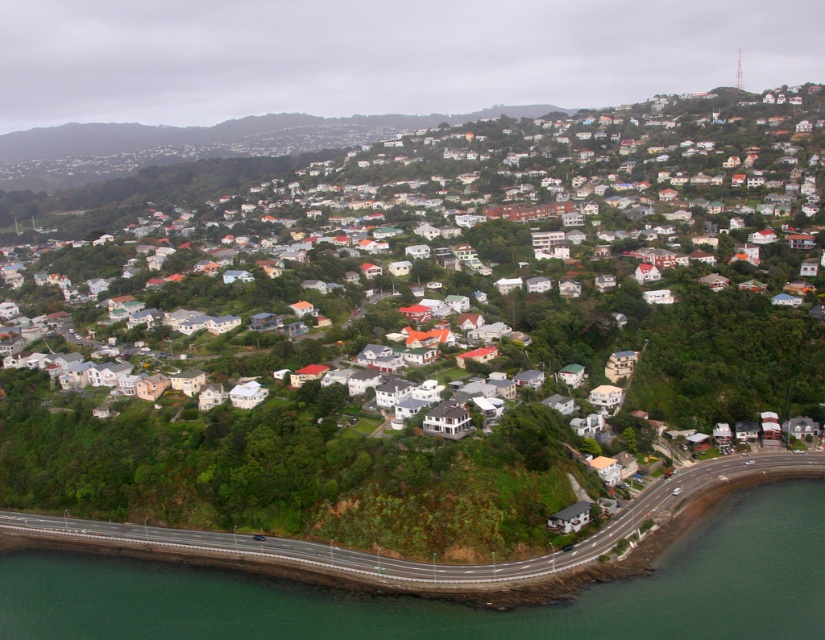
You are a drone operator tasked with capturing aerial footage of the residential area. Your camera has a zoom lens that can focus on objects up to 100 meters away. Given the scene, which object between the white matte houses at center and the green water at lower left would appear larger in your footage, and why?

The white matte houses at center would appear larger in the footage because they are physically larger in size compared to the green water at lower left, as stated in the description.

You are a drone operator tasked with capturing aerial footage of the residential area. The white matte houses at center and the green water at lower left are both in your camera frame. Which object occupies more horizontal space in the frame?

The white matte houses at center occupy more horizontal space in the frame because their width is larger than the green water at lower left.

You are a drone operator flying over the residential area. You need to deliver a package to the white matte houses at center and then to the green water at lower left. Which location should you visit first to follow the most efficient route?

You should visit the white matte houses at center first because it is to the left of the green water at lower left, so delivering to the white matte houses at center first allows you to proceed to the green water at lower left in the same direction without backtracking.